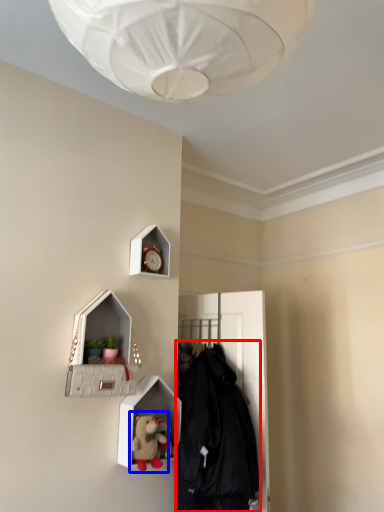
Question: Among these objects, which one is nearest to the camera, clothing (highlighted by a red box) or toy (highlighted by a blue box)?

Choices:
 (A) clothing
 (B) toy

Answer: (A)